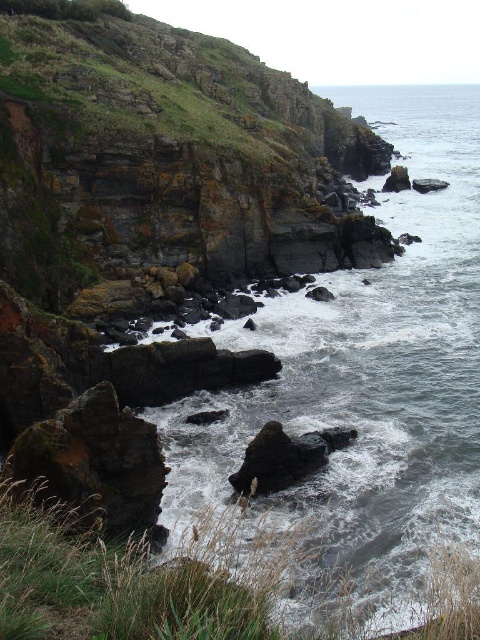
Question: Does gray rocky water at center appear on the right side of smooth dark rock at center?

Choices:
 (A) yes
 (B) no

Answer: (A)

Question: Which point is farther to the camera?

Choices:
 (A) (340, 428)
 (B) (372, 412)

Answer: (B)

Question: Does gray rocky water at center have a lesser width compared to smooth dark rock at center?

Choices:
 (A) yes
 (B) no

Answer: (B)

Question: Which of the following is the closest to the observer?

Choices:
 (A) gray rocky water at center
 (B) smooth dark rock at center

Answer: (A)

Question: Does gray rocky water at center appear under smooth dark rock at center?

Choices:
 (A) yes
 (B) no

Answer: (B)

Question: Which point is farther to the camera?

Choices:
 (A) smooth dark rock at center
 (B) gray rocky water at center

Answer: (A)